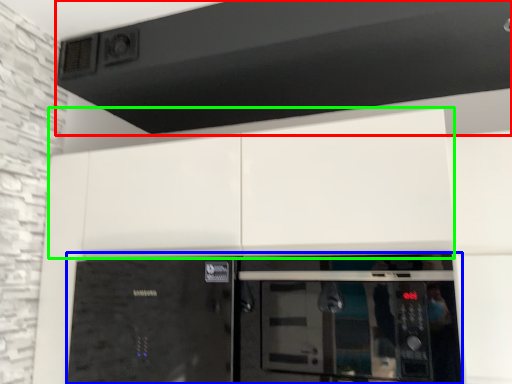
Question: Which object is the farthest from exhaust hood (highlighted by a red box)? Choose among these: home appliance (highlighted by a blue box) or cabinetry (highlighted by a green box).

Choices:
 (A) home appliance
 (B) cabinetry

Answer: (A)